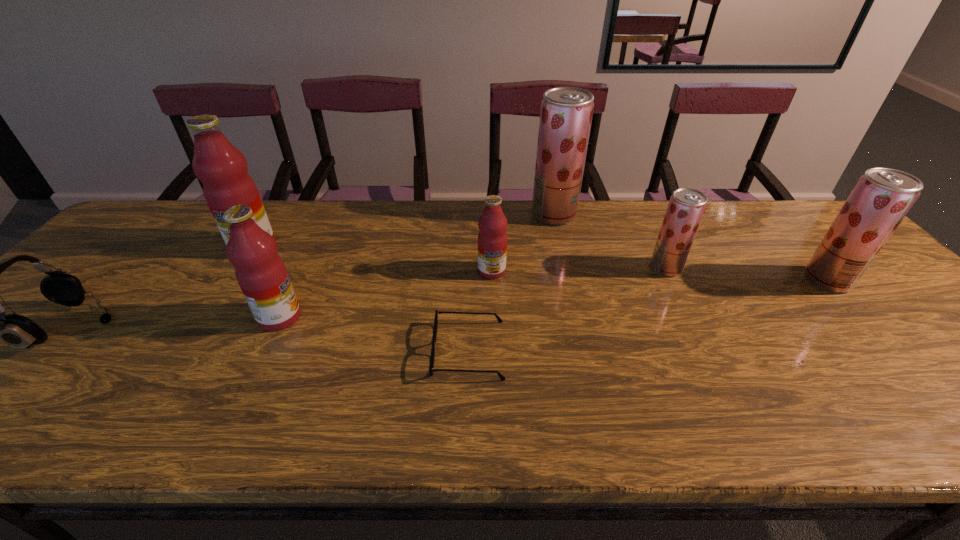
The width and height of the screenshot is (960, 540). Find the location of `vacant space at the right edge of the desktop`. vacant space at the right edge of the desktop is located at coordinates (954, 374).

In the image, there is a desktop. Where is `vacant space at the far left corner`? vacant space at the far left corner is located at coordinates (193, 211).

Find the location of a particular element. free spot between the farthest strawberry fruit juice and the nearest fruit juice is located at coordinates (417, 266).

This screenshot has width=960, height=540. What are the coordinates of `free space between the seventh object from right to left and the third object from right to left` in the screenshot? It's located at (403, 230).

Identify the location of free spot between the second biggest pink fruit juice and the headset. Image resolution: width=960 pixels, height=540 pixels. (177, 322).

Where is `blank region between the second biggest strawberry fruit juice and the spectacles`? The height and width of the screenshot is (540, 960). blank region between the second biggest strawberry fruit juice and the spectacles is located at coordinates (648, 315).

I want to click on unoccupied area between the leftmost object and the fifth fruit juice from right to left, so click(177, 322).

I want to click on free space between the rightmost pink fruit juice and the second smallest strawberry fruit juice, so click(660, 275).

Locate an element on the screen. free space that is in between the second biggest pink fruit juice and the leftmost object is located at coordinates (177, 322).

Identify the location of blank region between the nearest pink fruit juice and the seventh tallest object. This screenshot has width=960, height=540. (177, 322).